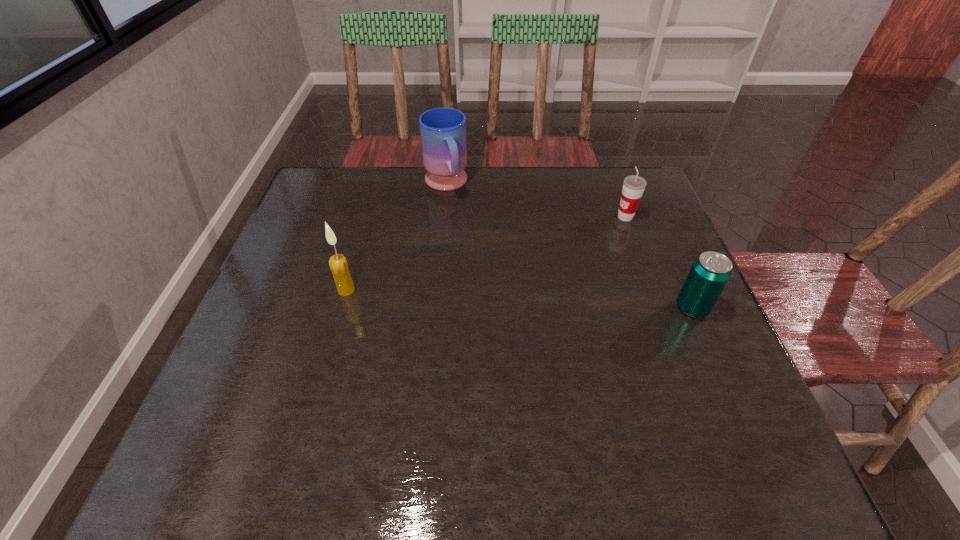
Locate an element on the screen. Image resolution: width=960 pixels, height=540 pixels. vacant space in between the beer can and the mug is located at coordinates (569, 246).

At what (x,y) coordinates should I click in order to perform the action: click on vacant area between the farthest object and the second object from right to left. Please return your answer as a coordinate pair (x, y). Looking at the image, I should click on (536, 201).

Locate an element on the screen. This screenshot has width=960, height=540. free space between the third object from right to left and the cup is located at coordinates (536, 201).

The image size is (960, 540). What are the coordinates of `free spot between the leftmost object and the third nearest object` in the screenshot? It's located at (486, 253).

This screenshot has height=540, width=960. Identify the location of free point between the farthest object and the leftmost object. (396, 237).

Locate an element on the screen. This screenshot has height=540, width=960. empty space between the beer can and the cup is located at coordinates click(x=659, y=262).

This screenshot has width=960, height=540. In order to click on object that ranks as the closest to the cup in this screenshot , I will do `click(709, 274)`.

Identify which object is the second closest to the cup. Please provide its 2D coordinates. Your answer should be formatted as a tuple, i.e. [(x, y)], where the tuple contains the x and y coordinates of a point satisfying the conditions above.

[(442, 130)]

This screenshot has height=540, width=960. Find the location of `free point that satisfies the following two spatial constraints: 1. on the front side of the cup; 2. on the right side of the mug`. free point that satisfies the following two spatial constraints: 1. on the front side of the cup; 2. on the right side of the mug is located at coordinates (443, 217).

At what (x,y) coordinates should I click in order to perform the action: click on vacant space that satisfies the following two spatial constraints: 1. on the back side of the third nearest object; 2. on the left side of the leftmost object. Please return your answer as a coordinate pair (x, y). Looking at the image, I should click on (368, 217).